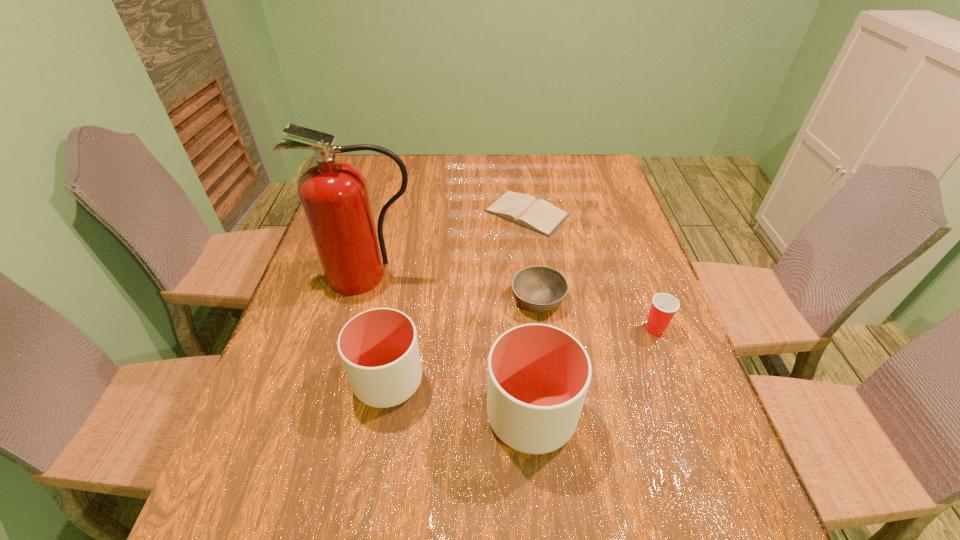
This screenshot has width=960, height=540. What are the coordinates of `the left cup` in the screenshot? It's located at (379, 349).

Find the location of a particular element. The height and width of the screenshot is (540, 960). the shorter cup is located at coordinates (379, 349).

Where is `the taller cup`? The width and height of the screenshot is (960, 540). the taller cup is located at coordinates (538, 376).

Image resolution: width=960 pixels, height=540 pixels. Identify the location of the right cup. pos(538,376).

The width and height of the screenshot is (960, 540). In order to click on the shortest object in this screenshot , I will do `click(539, 215)`.

This screenshot has width=960, height=540. I want to click on the farthest object, so click(539, 215).

The image size is (960, 540). I want to click on fire extinguisher, so click(334, 195).

Image resolution: width=960 pixels, height=540 pixels. In order to click on Dixie cup in this screenshot , I will do pos(664,306).

This screenshot has width=960, height=540. What are the coordinates of `the rightmost object` in the screenshot? It's located at (664, 306).

This screenshot has height=540, width=960. I want to click on the second shortest object, so click(540, 289).